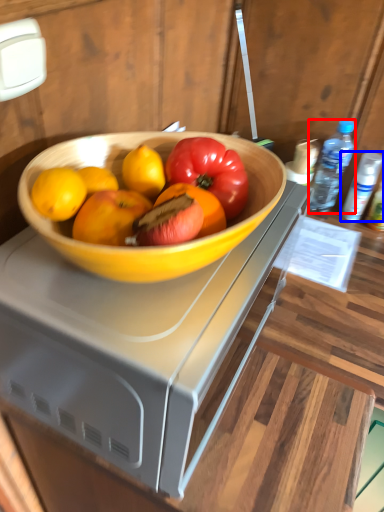
Question: Which object appears farthest to the camera in this image, bottle (highlighted by a red box) or bottle (highlighted by a blue box)?

Choices:
 (A) bottle
 (B) bottle

Answer: (B)